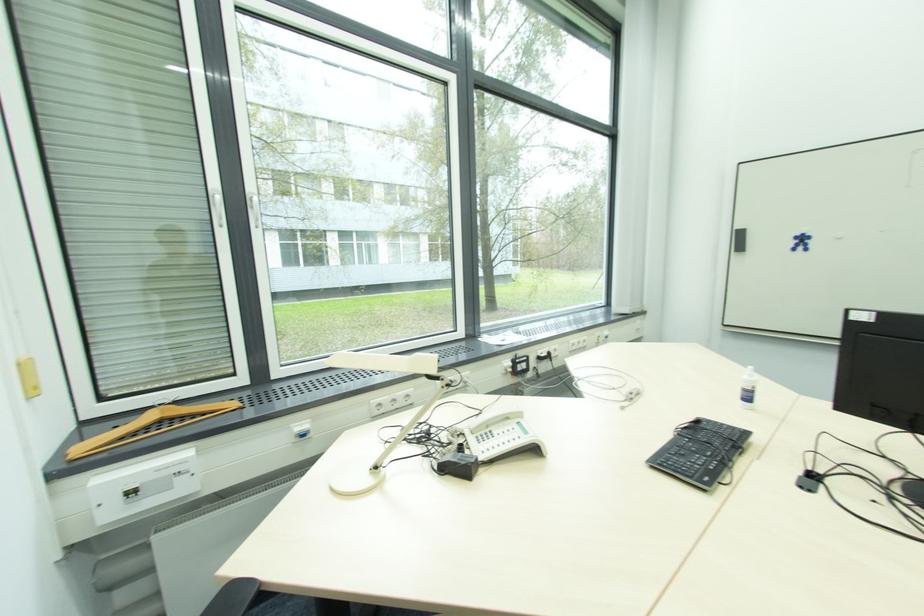
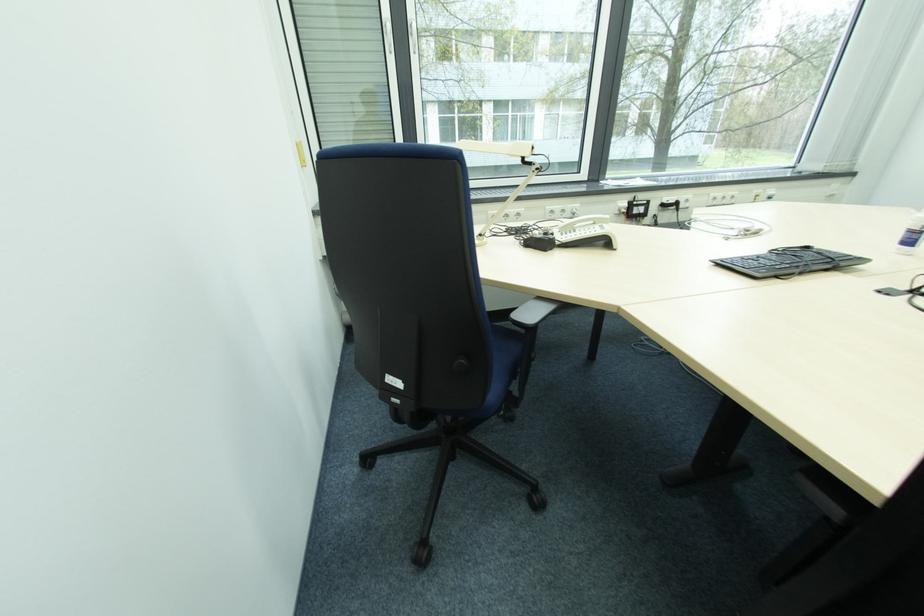
The first image is from the beginning of the video and the second image is from the end. How did the camera likely rotate when shooting the video?

The rotation direction of the camera is left-down.